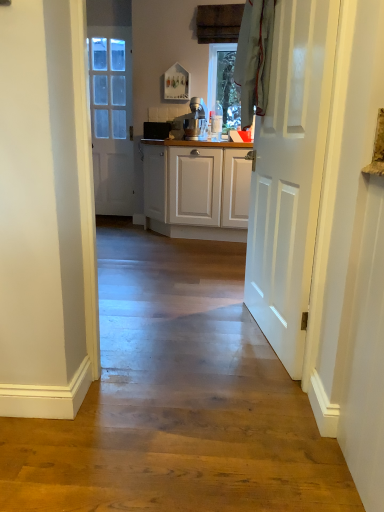
You are a GUI agent. You are given a task and a screenshot of the screen. Output one action in this format:
    pyautogui.click(x=<x>, y=<y>)
    Task: Click on the satin silver mixer at center, the 2th appliance from the back
    This screenshot has height=512, width=384.
    Given the screenshot: What is the action you would take?
    pyautogui.click(x=195, y=118)

What is the approximate width of white glossy door at left, the 1th door viewed from the back?

It is 3.52 inches.

The image size is (384, 512). I want to click on matte black toaster at center, positioned as the 2th appliance in front-to-back order, so [156, 130].

Could you tell me if satin silver mixer at center, the second appliance positioned from the left, is turned towards matte black toaster at center, marked as the first appliance in a left-to-right arrangement?

No.

From a real-world perspective, is satin silver mixer at center, which is the first appliance from front to back, physically below matte black toaster at center, placed as the 2th appliance when sorted from right to left?

Actually, satin silver mixer at center, which is the first appliance from front to back, is physically above matte black toaster at center, placed as the 2th appliance when sorted from right to left, in the real world.

Is point (201, 113) behind point (154, 132)?

No, (201, 113) is closer to viewer.

Between satin silver mixer at center, which ranks as the first appliance in right-to-left order, and matte black toaster at center, placed as the 2th appliance when sorted from right to left, which one has more height?

satin silver mixer at center, which ranks as the first appliance in right-to-left order, is taller.

The width and height of the screenshot is (384, 512). I want to click on door on the left of white glossy door at center, the first door from the right, so click(111, 118).

Between white glossy door at center, acting as the 2th door starting from the back, and white glossy door at left, positioned as the second door in right-to-left order, which one has smaller width?

With smaller width is white glossy door at left, positioned as the second door in right-to-left order.

Is white glossy door at center, which ranks as the 1th door in front-to-back order, not inside white glossy door at left, positioned as the second door in right-to-left order?

Absolutely, white glossy door at center, which ranks as the 1th door in front-to-back order, is external to white glossy door at left, positioned as the second door in right-to-left order.

Considering the positions of points (262, 287) and (115, 37), is point (262, 287) farther from camera compared to point (115, 37)?

No, (262, 287) is closer to viewer.

Is satin silver mixer at center, the second appliance positioned from the left, far from white glossy door at center, which ranks as the 1th door in front-to-back order?

Indeed, satin silver mixer at center, the second appliance positioned from the left, is not near white glossy door at center, which ranks as the 1th door in front-to-back order.

Considering the relative sizes of satin silver mixer at center, the second appliance positioned from the left, and white glossy door at center, the first door from the right, in the image provided, is satin silver mixer at center, the second appliance positioned from the left, smaller than white glossy door at center, the first door from the right,?

Correct, satin silver mixer at center, the second appliance positioned from the left, occupies less space than white glossy door at center, the first door from the right.

Does satin silver mixer at center, the 2th appliance from the back, have a lesser width compared to white glossy door at center, acting as the 2th door starting from the back?

No.

From a real-world perspective, between satin silver mixer at center, the second appliance positioned from the left, and white glossy door at center, which is the 2th door in left-to-right order, who is vertically lower?

In real-world perspective, white glossy door at center, which is the 2th door in left-to-right order, is lower.

How much distance is there between white glossy door at center, which ranks as the 1th door in front-to-back order, and matte black toaster at center, positioned as the 2th appliance in front-to-back order?

A distance of 2.46 meters exists between white glossy door at center, which ranks as the 1th door in front-to-back order, and matte black toaster at center, positioned as the 2th appliance in front-to-back order.

Is point (284, 224) closer to camera compared to point (159, 128)?

Yes, it is in front of point (159, 128).

Which is in front, white glossy door at center, acting as the 2th door starting from the back, or matte black toaster at center, positioned as the 2th appliance in front-to-back order?

white glossy door at center, acting as the 2th door starting from the back.

From a real-world perspective, who is located higher, white glossy door at center, the first door from the right, or matte black toaster at center, marked as the first appliance in a left-to-right arrangement?

From a 3D spatial view, matte black toaster at center, marked as the first appliance in a left-to-right arrangement, is above.

Consider the image. Who is bigger, white glossy door at left, positioned as the second door in right-to-left order, or satin silver mixer at center, the 2th appliance from the back?

white glossy door at left, positioned as the second door in right-to-left order, is bigger.

Which object is more forward, white glossy door at left, the 1th door viewed from the back, or satin silver mixer at center, which ranks as the first appliance in right-to-left order?

Positioned in front is satin silver mixer at center, which ranks as the first appliance in right-to-left order.

Can we say white glossy door at left, the 1th door viewed from the back, lies outside satin silver mixer at center, the second appliance positioned from the left?

Indeed, white glossy door at left, the 1th door viewed from the back, is completely outside satin silver mixer at center, the second appliance positioned from the left.

Considering the sizes of white glossy door at left, positioned as the second door in right-to-left order, and satin silver mixer at center, which ranks as the first appliance in right-to-left order, in the image, is white glossy door at left, positioned as the second door in right-to-left order, wider or thinner than satin silver mixer at center, which ranks as the first appliance in right-to-left order,?

In the image, white glossy door at left, positioned as the second door in right-to-left order, appears to be more narrow than satin silver mixer at center, which ranks as the first appliance in right-to-left order.

Based on their sizes in the image, would you say white glossy door at center, the first door from the right, is bigger or smaller than satin silver mixer at center, the 2th appliance from the back?

Clearly, white glossy door at center, the first door from the right, is larger in size than satin silver mixer at center, the 2th appliance from the back.

Is white glossy door at center, which ranks as the 1th door in front-to-back order, situated inside satin silver mixer at center, which ranks as the first appliance in right-to-left order, or outside?

white glossy door at center, which ranks as the 1th door in front-to-back order, lies outside satin silver mixer at center, which ranks as the first appliance in right-to-left order.

Who is shorter, white glossy door at center, which is the 2th door in left-to-right order, or satin silver mixer at center, which ranks as the first appliance in right-to-left order?

satin silver mixer at center, which ranks as the first appliance in right-to-left order.

From the image's perspective, is white glossy door at center, which ranks as the 1th door in front-to-back order, located above or below satin silver mixer at center, which ranks as the first appliance in right-to-left order?

From the image's perspective, white glossy door at center, which ranks as the 1th door in front-to-back order, appears below satin silver mixer at center, which ranks as the first appliance in right-to-left order.

Considering the relative positions of matte black toaster at center, marked as the first appliance in a back-to-front arrangement, and satin silver mixer at center, which is the first appliance from front to back, in the image provided, is matte black toaster at center, marked as the first appliance in a back-to-front arrangement, to the left or to the right of satin silver mixer at center, which is the first appliance from front to back,?

matte black toaster at center, marked as the first appliance in a back-to-front arrangement, is to the left of satin silver mixer at center, which is the first appliance from front to back.

Consider the image. From the image's perspective, does matte black toaster at center, positioned as the 2th appliance in front-to-back order, appear lower than satin silver mixer at center, which ranks as the first appliance in right-to-left order?

Yes, from the image's perspective, matte black toaster at center, positioned as the 2th appliance in front-to-back order, is below satin silver mixer at center, which ranks as the first appliance in right-to-left order.

Considering the sizes of objects matte black toaster at center, marked as the first appliance in a back-to-front arrangement, and satin silver mixer at center, the 2th appliance from the back, in the image provided, who is shorter, matte black toaster at center, marked as the first appliance in a back-to-front arrangement, or satin silver mixer at center, the 2th appliance from the back,?

matte black toaster at center, marked as the first appliance in a back-to-front arrangement, is shorter.

Locate an element on the screen. The image size is (384, 512). appliance that is above the matte black toaster at center, placed as the 2th appliance when sorted from right to left (from a real-world perspective) is located at coordinates (195, 118).

At what (x,y) coordinates should I click in order to perform the action: click on door behind the white glossy door at center, acting as the 2th door starting from the back. Please return your answer as a coordinate pair (x, y). Looking at the image, I should click on (111, 118).

When comparing their distances from matte black toaster at center, marked as the first appliance in a left-to-right arrangement, does satin silver mixer at center, which ranks as the first appliance in right-to-left order, or white glossy door at left, the second door viewed from the front, seem closer?

Among the two, satin silver mixer at center, which ranks as the first appliance in right-to-left order, is located nearer to matte black toaster at center, marked as the first appliance in a left-to-right arrangement.

Considering their positions, is white glossy door at center, which ranks as the 1th door in front-to-back order, positioned closer to satin silver mixer at center, which is the first appliance from front to back, than matte black toaster at center, positioned as the 2th appliance in front-to-back order?

Based on the image, matte black toaster at center, positioned as the 2th appliance in front-to-back order, appears to be nearer to satin silver mixer at center, which is the first appliance from front to back.

Considering their positions, is white glossy door at left, the 1th door when ordered from left to right, positioned closer to satin silver mixer at center, the second appliance positioned from the left, than matte black toaster at center, marked as the first appliance in a back-to-front arrangement?

matte black toaster at center, marked as the first appliance in a back-to-front arrangement.

Looking at the image, which one is located further to satin silver mixer at center, the second appliance positioned from the left, matte black toaster at center, marked as the first appliance in a left-to-right arrangement, or white glossy door at left, the 1th door viewed from the back?

white glossy door at left, the 1th door viewed from the back, is positioned further to the anchor satin silver mixer at center, the second appliance positioned from the left.

From the image, which object appears to be farther from white glossy door at left, the 1th door when ordered from left to right, satin silver mixer at center, the second appliance positioned from the left, or matte black toaster at center, positioned as the 2th appliance in front-to-back order?

Based on the image, satin silver mixer at center, the second appliance positioned from the left, appears to be further to white glossy door at left, the 1th door when ordered from left to right.

Considering their positions, is white glossy door at left, the 1th door when ordered from left to right, positioned further to white glossy door at center, the first door from the right, than matte black toaster at center, positioned as the 2th appliance in front-to-back order?

Among the two, white glossy door at left, the 1th door when ordered from left to right, is located further to white glossy door at center, the first door from the right.

When comparing their distances from white glossy door at center, the first door from the right, does matte black toaster at center, placed as the 2th appliance when sorted from right to left, or white glossy door at left, the 1th door when ordered from left to right, seem closer?

Among the two, matte black toaster at center, placed as the 2th appliance when sorted from right to left, is located nearer to white glossy door at center, the first door from the right.

Based on their spatial positions, is matte black toaster at center, marked as the first appliance in a left-to-right arrangement, or satin silver mixer at center, the 2th appliance from the back, closer to white glossy door at left, the second door viewed from the front?

matte black toaster at center, marked as the first appliance in a left-to-right arrangement, is closer to white glossy door at left, the second door viewed from the front.

Locate an element on the screen. The width and height of the screenshot is (384, 512). appliance between white glossy door at center, which is the 2th door in left-to-right order, and matte black toaster at center, marked as the first appliance in a back-to-front arrangement, in the front-back direction is located at coordinates click(x=195, y=118).

The height and width of the screenshot is (512, 384). Find the location of `appliance between white glossy door at left, positioned as the second door in right-to-left order, and satin silver mixer at center, which is the first appliance from front to back`. appliance between white glossy door at left, positioned as the second door in right-to-left order, and satin silver mixer at center, which is the first appliance from front to back is located at coordinates (156, 130).